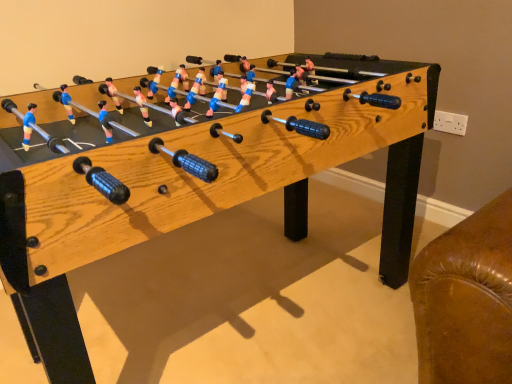
Locate an element on the screen. natural wood foosball table at center is located at coordinates (202, 195).

In the scene shown: What is the approximate width of natural wood foosball table at center?

1.20 meters.

Measure the distance between point (91, 193) and camera.

A distance of 27.87 inches exists between point (91, 193) and camera.

The image size is (512, 384). What do you see at coordinates (202, 195) in the screenshot?
I see `natural wood foosball table at center` at bounding box center [202, 195].

At what (x,y) coordinates should I click in order to perform the action: click on natural wood foosball table at center. Please return your answer as a coordinate pair (x, y). The width and height of the screenshot is (512, 384). Looking at the image, I should click on (202, 195).